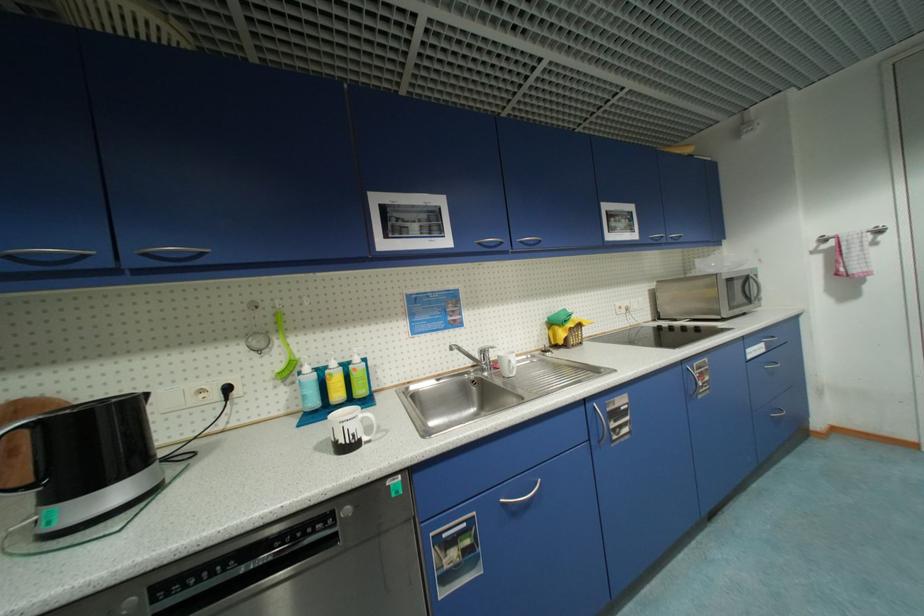
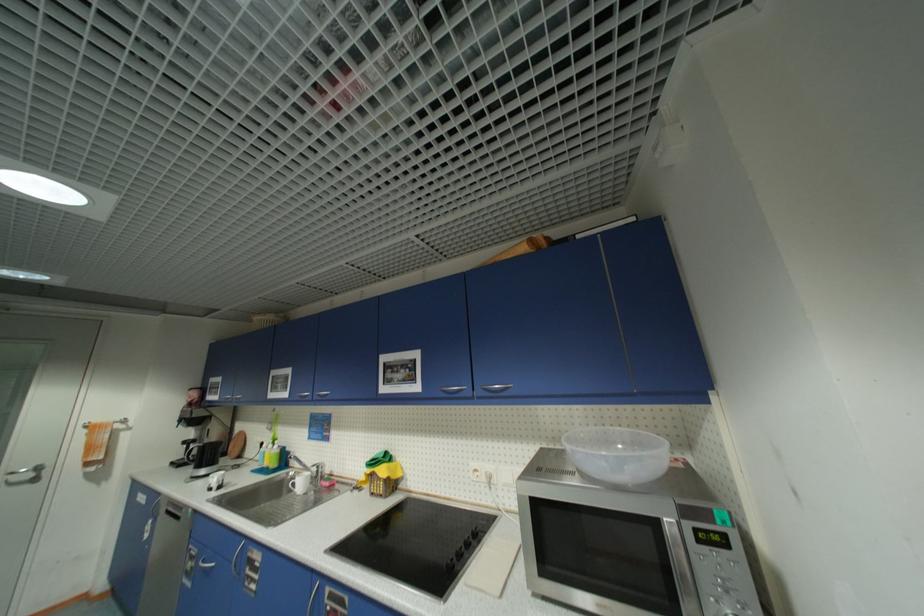
Find the pixel in the second image that matches the point at 414,390 in the first image.

(294, 475)